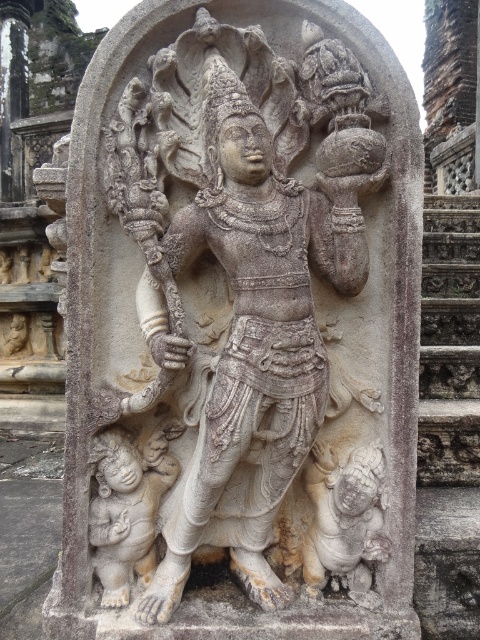
You are examining the stone relief sculpture and notice two points marked on it. The first point is at coordinates point (257, 161) and the second is at point (435, 262). From your vantage point, which of these two points appears closer to you?

Point (257, 161) is closer to the camera than point (435, 262), so the first point appears closer to you.

You are an archaeologist examining the stone relief sculpture. You notice the gray stone statue at center and the gray stone stairs at center. Based on their positions, which object is located lower in the image?

The gray stone statue at center is located lower than the gray stone stairs at center because the description states that the gray stone statue at center is below the gray stone stairs at center.